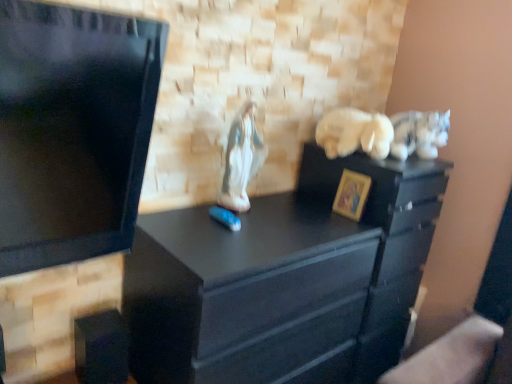
Describe the element at coordinates (241, 159) in the screenshot. I see `porcelain statue at center, the first animal viewed from the left` at that location.

Where is `porcelain statue at center, the first animal viewed from the left`? This screenshot has height=384, width=512. porcelain statue at center, the first animal viewed from the left is located at coordinates (241, 159).

Locate an element on the screen. This screenshot has width=512, height=384. black matte file cabinet at center is located at coordinates (383, 240).

What is the approximate height of black matte file cabinet at center?

1.22 meters.

This screenshot has width=512, height=384. Find the location of `white plush cat at upper right, which is the first animal from right to left`. white plush cat at upper right, which is the first animal from right to left is located at coordinates (419, 133).

In the scene shown: Can you confirm if black matte file cabinet at center is smaller than black matte chest of drawers at center?

Indeed, black matte file cabinet at center has a smaller size compared to black matte chest of drawers at center.

From the image's perspective, is black matte file cabinet at center over black matte chest of drawers at center?

Correct, black matte file cabinet at center appears higher than black matte chest of drawers at center in the image.

Is black matte chest of drawers at center a part of black matte file cabinet at center?

That's incorrect, black matte chest of drawers at center is not inside black matte file cabinet at center.

Is point (338, 205) in front of point (243, 152)?

No.

Is gold painted wood picture frame at center right oriented towards porcelain statue at center, which is the 3th animal in right-to-left order?

No.

Which object is closer to the camera taking this photo, gold painted wood picture frame at center right or porcelain statue at center, the first animal viewed from the left?

porcelain statue at center, the first animal viewed from the left, is more forward.

From a real-world perspective, is white plush cat at upper right, which is the first animal from right to left, physically above white plush bear at upper right, arranged as the 2th animal when viewed from the right?

Indeed, from a real-world perspective, white plush cat at upper right, which is the first animal from right to left, stands above white plush bear at upper right, arranged as the 2th animal when viewed from the right.

Is white plush cat at upper right, arranged as the third animal when viewed from the left, far away from white plush bear at upper right, arranged as the 2th animal when viewed from the right?

That's not correct — white plush cat at upper right, arranged as the third animal when viewed from the left, is a little close to white plush bear at upper right, arranged as the 2th animal when viewed from the right.

Is white plush bear at upper right, arranged as the 2th animal when viewed from the right, surrounded by white plush cat at upper right, which is the first animal from right to left?

No, white plush bear at upper right, arranged as the 2th animal when viewed from the right, is not surrounded by white plush cat at upper right, which is the first animal from right to left.

Is white plush cat at upper right, arranged as the third animal when viewed from the left, turned away from white plush bear at upper right, the 2th animal in the left-to-right sequence?

white plush cat at upper right, arranged as the third animal when viewed from the left, does not have its back to white plush bear at upper right, the 2th animal in the left-to-right sequence.

Who is more distant, white plush bear at upper right, arranged as the 2th animal when viewed from the right, or porcelain statue at center, the first animal viewed from the left?

white plush bear at upper right, arranged as the 2th animal when viewed from the right, is behind.

How many degrees apart are the facing directions of white plush bear at upper right, the 2th animal in the left-to-right sequence, and porcelain statue at center, the first animal viewed from the left?

The angular difference between white plush bear at upper right, the 2th animal in the left-to-right sequence, and porcelain statue at center, the first animal viewed from the left, is 4.94 degrees.

In terms of height, does white plush bear at upper right, arranged as the 2th animal when viewed from the right, look taller or shorter compared to porcelain statue at center, the first animal viewed from the left?

In the image, white plush bear at upper right, arranged as the 2th animal when viewed from the right, appears to be shorter than porcelain statue at center, the first animal viewed from the left.

From the image's perspective, is white plush bear at upper right, arranged as the 2th animal when viewed from the right, beneath porcelain statue at center, which is the 3th animal in right-to-left order?

No, from the image's perspective, white plush bear at upper right, arranged as the 2th animal when viewed from the right, is not beneath porcelain statue at center, which is the 3th animal in right-to-left order.

Does black matte chest of drawers at center contain white plush bear at upper right, arranged as the 2th animal when viewed from the right?

That's incorrect, white plush bear at upper right, arranged as the 2th animal when viewed from the right, is not inside black matte chest of drawers at center.

Is black matte chest of drawers at center turned away from white plush bear at upper right, arranged as the 2th animal when viewed from the right?

No, black matte chest of drawers at center is not facing the opposite direction of white plush bear at upper right, arranged as the 2th animal when viewed from the right.

From a real-world perspective, is black matte chest of drawers at center positioned over white plush bear at upper right, the 2th animal in the left-to-right sequence, based on gravity?

No.

From the image's perspective, is gold painted wood picture frame at center right above or below black matte chest of drawers at center?

Based on their image positions, gold painted wood picture frame at center right is located above black matte chest of drawers at center.

Can you confirm if gold painted wood picture frame at center right is wider than black matte chest of drawers at center?

No, gold painted wood picture frame at center right is not wider than black matte chest of drawers at center.

Is gold painted wood picture frame at center right to the left of black matte chest of drawers at center from the viewer's perspective?

No, gold painted wood picture frame at center right is not to the left of black matte chest of drawers at center.

Is black matte chest of drawers at center in contact with black matte file cabinet at center?

No, black matte chest of drawers at center is not in contact with black matte file cabinet at center.

Find the location of a particular element. chest of drawers below the black matte file cabinet at center (from a real-world perspective) is located at coordinates (284, 281).

From the image's perspective, does black matte chest of drawers at center appear higher than black matte file cabinet at center?

No, from the image's perspective, black matte chest of drawers at center is not above black matte file cabinet at center.

Between black matte chest of drawers at center and black matte file cabinet at center, which one has less height?

black matte chest of drawers at center is shorter.

The image size is (512, 384). Identify the location of file cabinet on the right of the black matte chest of drawers at center. 383,240.

This screenshot has height=384, width=512. Find the location of `animal that is the 1st one above the gold painted wood picture frame at center right (from a real-world perspective)`. animal that is the 1st one above the gold painted wood picture frame at center right (from a real-world perspective) is located at coordinates (241, 159).

From the image, which object appears to be farther from white plush cat at upper right, arranged as the third animal when viewed from the left, black matte file cabinet at center or black matte chest of drawers at center?

Among the two, black matte chest of drawers at center is located further to white plush cat at upper right, arranged as the third animal when viewed from the left.

Estimate the real-world distances between objects in this image. Which object is closer to gold painted wood picture frame at center right, white plush bear at upper right, arranged as the 2th animal when viewed from the right, or white plush cat at upper right, which is the first animal from right to left?

white plush bear at upper right, arranged as the 2th animal when viewed from the right, lies closer to gold painted wood picture frame at center right than the other object.

From the image, which object appears to be farther from gold painted wood picture frame at center right, black matte chest of drawers at center or white plush cat at upper right, which is the first animal from right to left?

black matte chest of drawers at center lies further to gold painted wood picture frame at center right than the other object.

When comparing their distances from white plush cat at upper right, which is the first animal from right to left, does white plush bear at upper right, the 2th animal in the left-to-right sequence, or gold painted wood picture frame at center right seem closer?

white plush bear at upper right, the 2th animal in the left-to-right sequence, is closer to white plush cat at upper right, which is the first animal from right to left.

Considering their positions, is porcelain statue at center, the first animal viewed from the left, positioned closer to black matte file cabinet at center than gold painted wood picture frame at center right?

Among the two, gold painted wood picture frame at center right is located nearer to black matte file cabinet at center.

Which object lies further to the anchor point black matte file cabinet at center, white plush cat at upper right, which is the first animal from right to left, or gold painted wood picture frame at center right?

Based on the image, white plush cat at upper right, which is the first animal from right to left, appears to be further to black matte file cabinet at center.

Looking at the image, which one is located further to porcelain statue at center, which is the 3th animal in right-to-left order, gold painted wood picture frame at center right or black matte file cabinet at center?

black matte file cabinet at center.

Which object lies nearer to the anchor point black matte chest of drawers at center, white plush bear at upper right, the 2th animal in the left-to-right sequence, or gold painted wood picture frame at center right?

Among the two, gold painted wood picture frame at center right is located nearer to black matte chest of drawers at center.

The height and width of the screenshot is (384, 512). In order to click on animal between white plush bear at upper right, the 2th animal in the left-to-right sequence, and black matte file cabinet at center from top to bottom in this screenshot , I will do `click(241, 159)`.

At what (x,y) coordinates should I click in order to perform the action: click on picture frame between porcelain statue at center, the first animal viewed from the left, and white plush cat at upper right, which is the first animal from right to left, in the horizontal direction. Please return your answer as a coordinate pair (x, y). The height and width of the screenshot is (384, 512). Looking at the image, I should click on (351, 194).

You are a GUI agent. You are given a task and a screenshot of the screen. Output one action in this format:
    pyautogui.click(x=<x>, y=<y>)
    Task: Click on the animal between white plush bear at upper right, arranged as the 2th animal when viewed from the right, and black matte chest of drawers at center in the up-down direction
    This screenshot has width=512, height=384.
    Given the screenshot: What is the action you would take?
    pyautogui.click(x=241, y=159)

Locate an element on the screen. The width and height of the screenshot is (512, 384). file cabinet between gold painted wood picture frame at center right and black matte chest of drawers at center in the up-down direction is located at coordinates (383, 240).